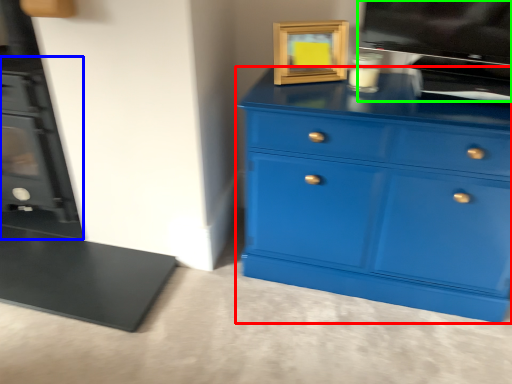
Question: Considering the real-world distances, which object is closest to chest of drawers (highlighted by a red box)? fireplace (highlighted by a blue box) or appliance (highlighted by a green box).

Choices:
 (A) fireplace
 (B) appliance

Answer: (B)